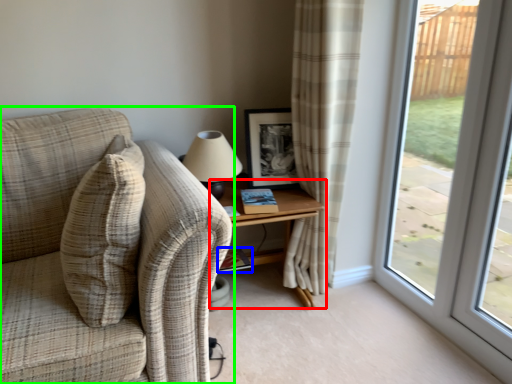
Question: Which object is positioned closest to table (highlighted by a red box)? Select from book (highlighted by a blue box) and studio couch (highlighted by a green box).

Choices:
 (A) book
 (B) studio couch

Answer: (A)